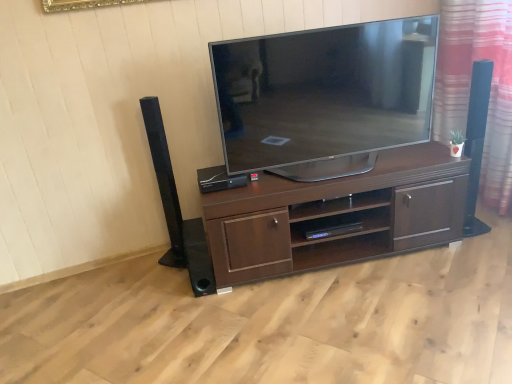
Question: In terms of size, does black plastic speaker at center, arranged as the 1th speaker when viewed from the right, appear bigger or smaller than black plastic shelf at center?

Choices:
 (A) small
 (B) big

Answer: (A)

Question: Considering the positions of point (205, 178) and point (309, 220), is point (205, 178) closer or farther from the camera than point (309, 220)?

Choices:
 (A) farther
 (B) closer

Answer: (B)

Question: Estimate the real-world distances between objects in this image. Which object is farther from the satin black tv at center?

Choices:
 (A) black plastic speaker at center, which is the third speaker in left-to-right order
 (B) black matte speaker at left, the 1th speaker from the left
 (C) velvet-like red curtain at right
 (D) black plastic shelf at center
 (E) black matte speaker at lower center, acting as the 2th speaker starting from the left

Answer: (C)

Question: Which is farther from the black plastic speaker at center, which is the third speaker in left-to-right order?

Choices:
 (A) satin black tv at center
 (B) black matte speaker at lower center, acting as the 2th speaker starting from the left
 (C) velvet-like red curtain at right
 (D) dark brown wood tv stand at center
 (E) black matte speaker at left, the 1th speaker from the left

Answer: (C)